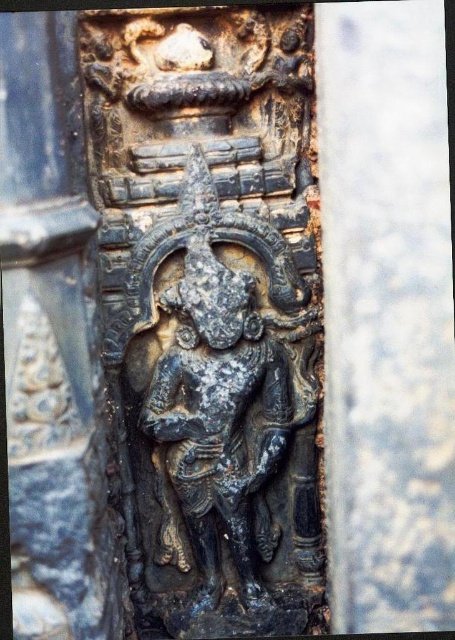
Question: Which object is positioned farthest from the black stone carving at center?

Choices:
 (A) dark gray stone statue at center
 (B) dark gray stone carving at center

Answer: (B)

Question: Is dark gray stone carving at center positioned in front of dark gray stone statue at center?

Choices:
 (A) yes
 (B) no

Answer: (A)

Question: Does black stone carving at center have a greater width compared to dark gray stone carving at center?

Choices:
 (A) no
 (B) yes

Answer: (B)

Question: Among these objects, which one is farthest from the camera?

Choices:
 (A) dark gray stone carving at center
 (B) dark gray stone statue at center

Answer: (B)

Question: Does black stone carving at center lie in front of dark gray stone carving at center?

Choices:
 (A) no
 (B) yes

Answer: (A)

Question: Which is farther from the dark gray stone carving at center?

Choices:
 (A) dark gray stone statue at center
 (B) black stone carving at center

Answer: (A)